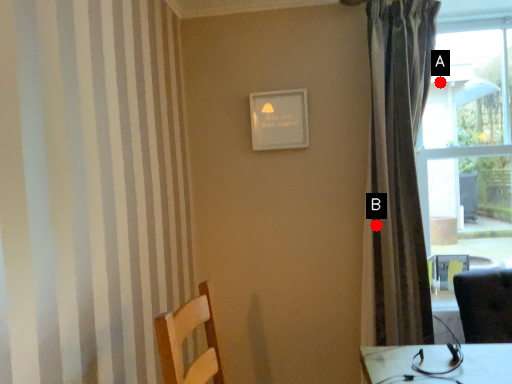
Question: Two points are circled on the image, labeled by A and B beside each circle. Which point is closer to the camera taking this photo?

Choices:
 (A) A is closer
 (B) B is closer

Answer: (B)